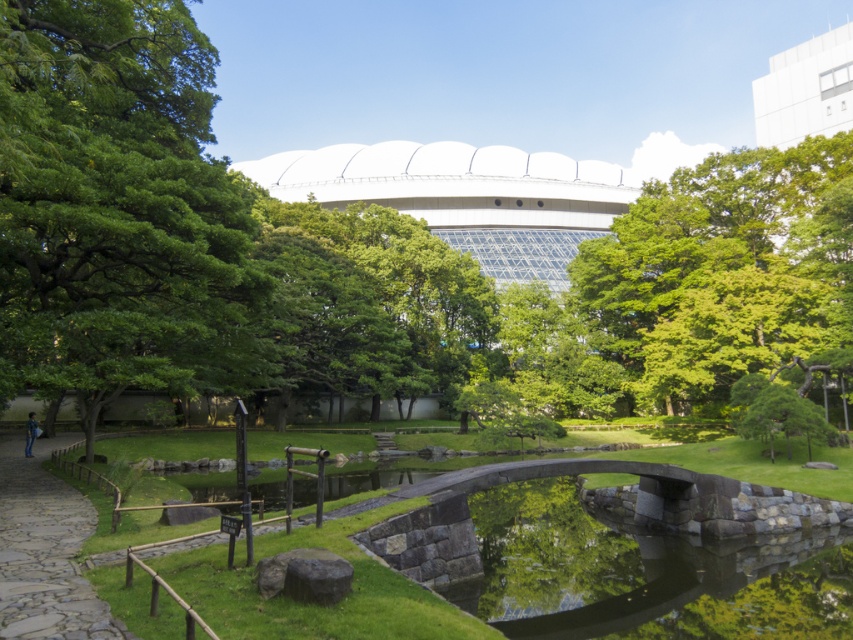
You are a park visitor who wants to take a photo of both the green leafy tree at upper left and the green leafy tree at upper center. Which tree should you stand closer to in order to capture both in a single frame?

You should stand closer to the green leafy tree at upper left because it is smaller than the green leafy tree at upper center, allowing both to fit within the camera frame more easily.

You are a landscape architect designing a new garden. You need to place a statue that is 2 meters wide between the green leafy tree at upper center and the pebble stone path at lower left. Based on their widths, will the statue fit between them?

The green leafy tree at upper center is wider than the pebble stone path at lower left. Since the statue is 2 meters wide, you need to ensure there is enough space between them. However, the exact distance between the two objects isn

You are a landscape architect designing a new park layout. You need to ensure that the green leafy tree at upper left and the pebble stone path at lower left are visible from a central viewpoint. Given their relative heights, which object might block the view of the other when viewed from this central point?

The green leafy tree at upper left is taller than the pebble stone path at lower left, so it might block the view of the path if positioned between the viewpoint and the path.